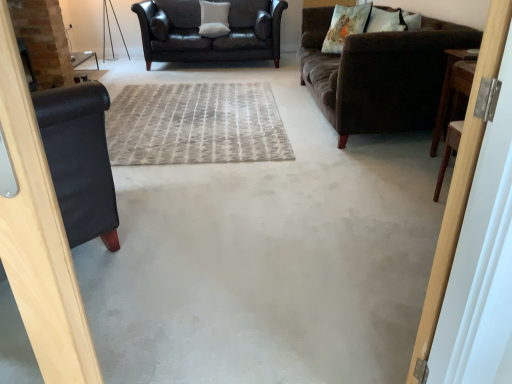
Locate an element on the screen. vacant space behind brown wooden table at right is located at coordinates (417, 149).